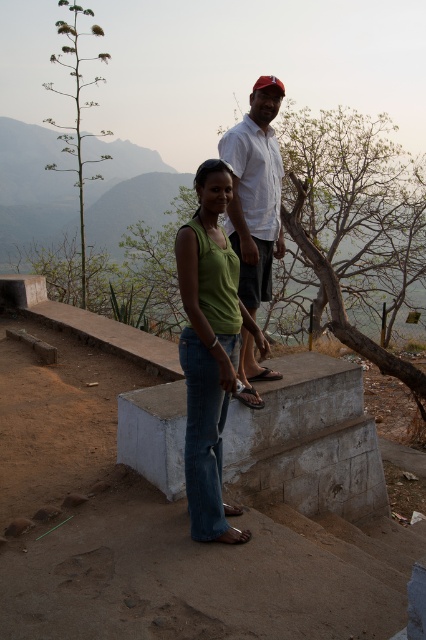
You are standing at the center of the image and want to locate the green matte tank top at center. Which direction should you look to find it?

The green matte tank top at center is already at the center of the image, so you can look straight ahead to find it.

You are taking a photo of the two people in the scene. The photographer wants to ensure that the green matte tank top at center and the white cotton shirt at upper center are both clearly visible. Which person should be positioned to the right side of the frame to achieve this?

The white cotton shirt at upper center should be positioned to the right side of the frame because the green matte tank top at center is currently to the left of it. By moving the person in the white cotton shirt to the right, both items will be arranged so that the green matte tank top at center is on the left and the white cotton shirt at upper center is on the right, ensuring they are both visible in the photo.

In the scene shown: You are standing at the point labeled point (x=222, y=147) and want to walk to the point labeled point (x=226, y=378). Given that you can only move forward in a straight line, will you be moving towards or away from the person in the green top?

The point labeled point (x=226, y=378) is closer to the viewer than point (x=222, y=147). Since you are moving from point (x=222, y=147) to point (x=226, y=378), you are moving towards the person in the green top because the destination point is closer to the viewer.